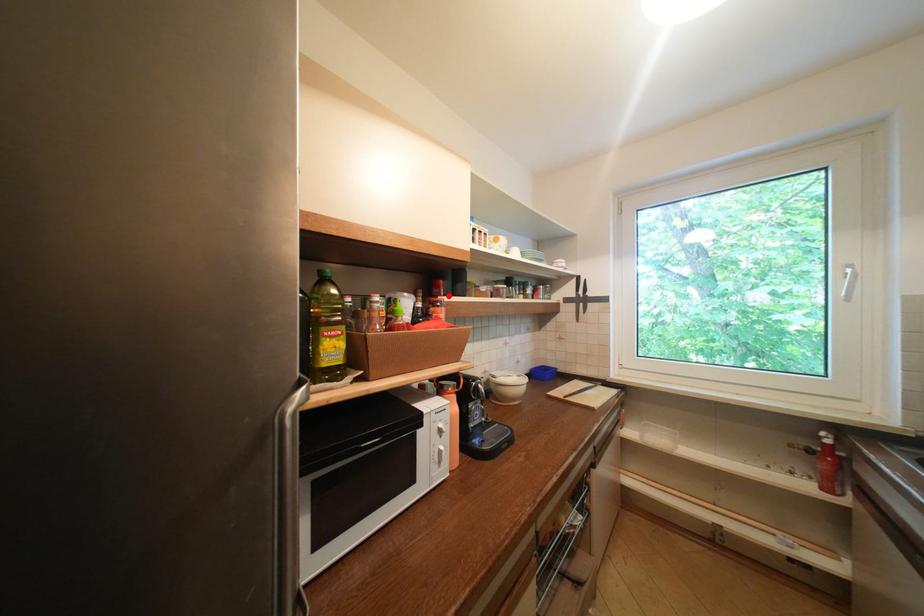
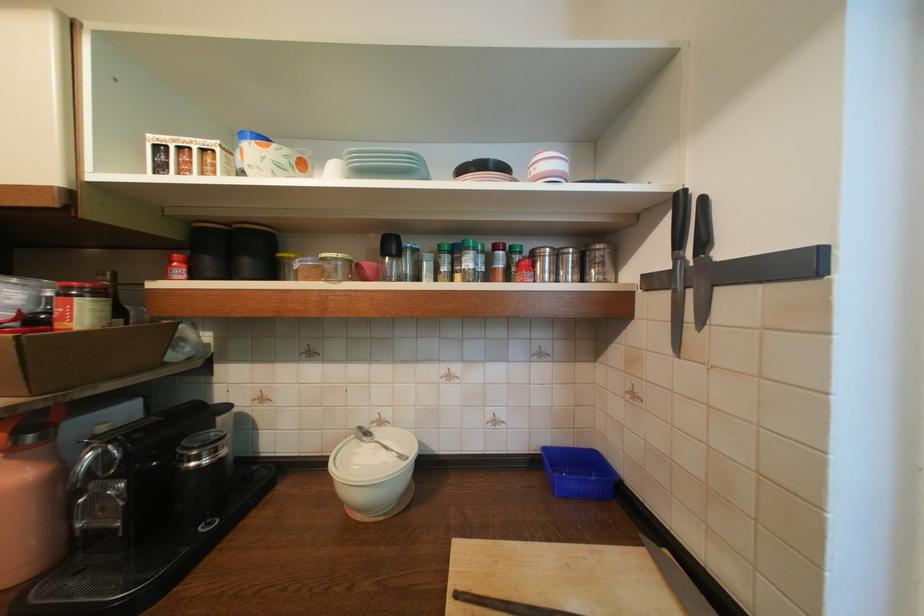
Question: I am providing you with two images of the same scene from different viewpoints. A red point is marked on the first image. At the location where the point appears in image 1, is it still visible in image 2?

Choices:
 (A) Yes
 (B) No

Answer: (A)